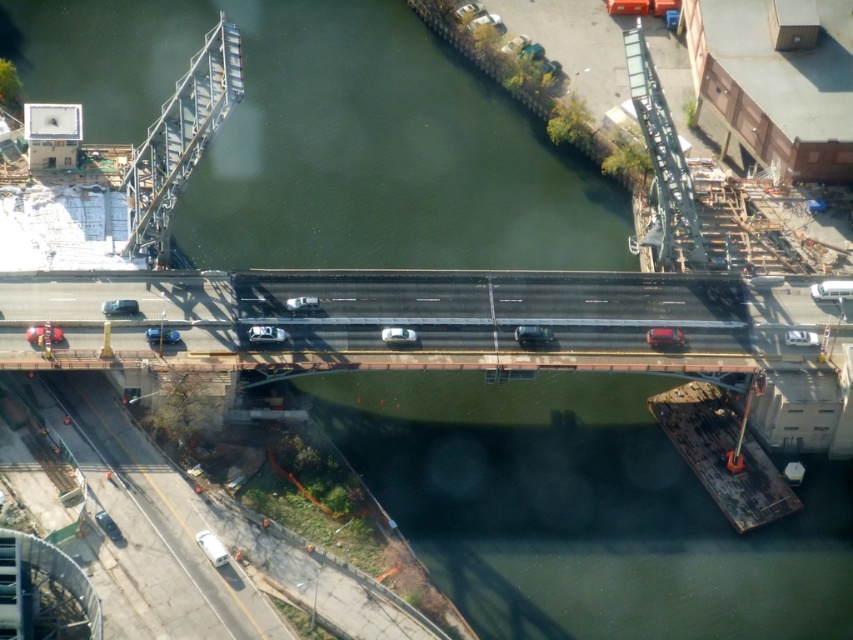
Question: Which point is closer to the camera?

Choices:
 (A) click(x=827, y=284)
 (B) click(x=300, y=298)

Answer: (B)

Question: Which point appears farthest from the camera in this image?

Choices:
 (A) (277, 337)
 (B) (494, 26)
 (C) (457, 10)
 (D) (213, 554)

Answer: (C)

Question: Can you confirm if white glossy van at center is wider than matte black sedan at left?

Choices:
 (A) yes
 (B) no

Answer: (B)

Question: Which object is the farthest from the shiny silver sedan at center?

Choices:
 (A) matte silver sedan at center
 (B) shiny red sedan at center
 (C) matte silver sedan at upper center
 (D) shiny silver sedan at lower left

Answer: (D)

Question: Does white glossy van at center appear on the right side of white glossy sedan at center?

Choices:
 (A) yes
 (B) no

Answer: (A)

Question: Can you confirm if white glossy car at center is thinner than shiny silver sedan at lower left?

Choices:
 (A) no
 (B) yes

Answer: (A)